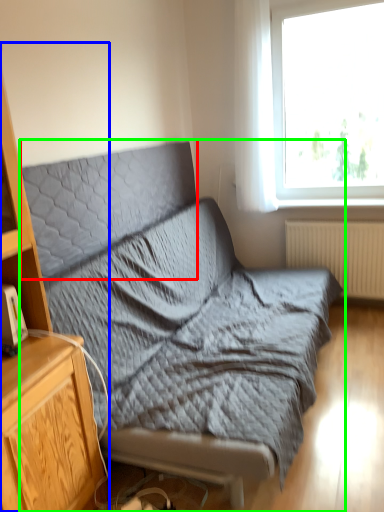
Question: Which is nearer to the pillow (highlighted by a red box)? cabinetry (highlighted by a blue box) or studio couch (highlighted by a green box).

Choices:
 (A) cabinetry
 (B) studio couch

Answer: (B)